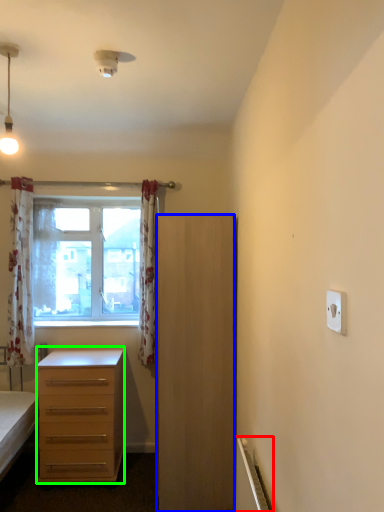
Question: Which object is the farthest from radiator (highlighted by a red box)? Choose among these: cabinetry (highlighted by a blue box) or desk (highlighted by a green box).

Choices:
 (A) cabinetry
 (B) desk

Answer: (B)